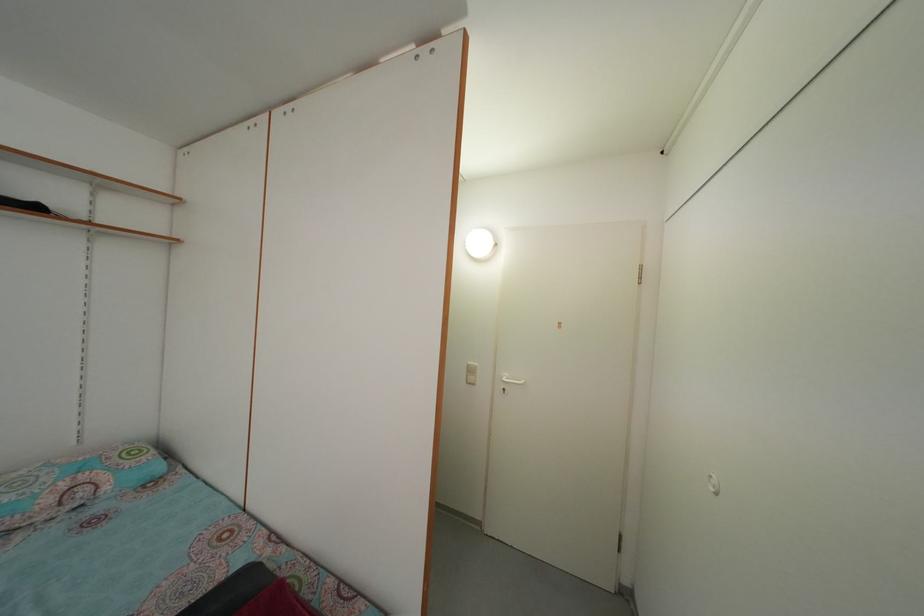
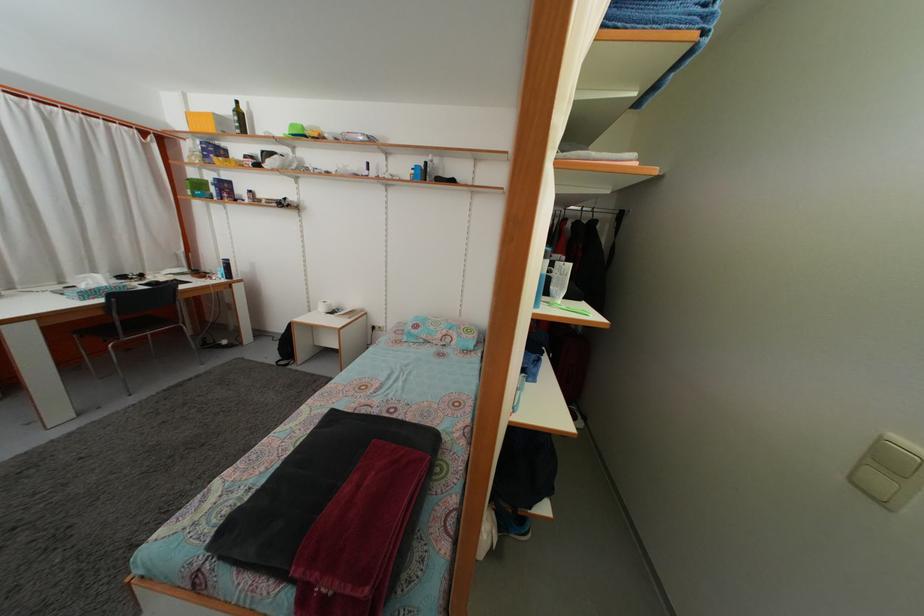
The point at (476, 371) is marked in the first image. Where is the corresponding point in the second image?

(903, 445)